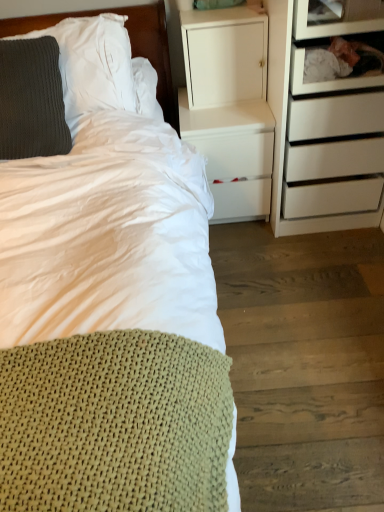
Question: From a real-world perspective, is transparent glass shelf at upper right, which ranks as the 1th shelf in top-to-bottom order, beneath knitted gray pillow at left, which ranks as the 2th pillow in bottom-to-top order?

Choices:
 (A) no
 (B) yes

Answer: (A)

Question: Is transparent glass shelf at upper right, the second shelf ordered from the bottom, located outside knitted gray pillow at left, which ranks as the 2th pillow in bottom-to-top order?

Choices:
 (A) no
 (B) yes

Answer: (B)

Question: Are transparent glass shelf at upper right, which ranks as the 1th shelf in top-to-bottom order, and knitted gray pillow at left, which ranks as the 2th pillow in bottom-to-top order, located far from each other?

Choices:
 (A) yes
 (B) no

Answer: (B)

Question: Is transparent glass shelf at upper right, the second shelf ordered from the bottom, in contact with knitted gray pillow at left, which is the 1th pillow in top-to-bottom order?

Choices:
 (A) yes
 (B) no

Answer: (B)

Question: Is transparent glass shelf at upper right, which ranks as the 1th shelf in top-to-bottom order, behind knitted gray pillow at left, which is the 1th pillow in top-to-bottom order?

Choices:
 (A) no
 (B) yes

Answer: (B)

Question: Would you say white matte nightstand at center is to the left or to the right of knitted gray pillow at left, which is the 1th pillow in top-to-bottom order, in the picture?

Choices:
 (A) right
 (B) left

Answer: (A)

Question: In terms of width, does white matte nightstand at center look wider or thinner when compared to knitted gray pillow at left, which ranks as the 2th pillow in bottom-to-top order?

Choices:
 (A) wide
 (B) thin

Answer: (A)

Question: Is point (241, 207) closer or farther from the camera than point (124, 80)?

Choices:
 (A) farther
 (B) closer

Answer: (A)

Question: From the image's perspective, is white matte nightstand at center above or below knitted gray pillow at left, which ranks as the 2th pillow in bottom-to-top order?

Choices:
 (A) below
 (B) above

Answer: (A)

Question: Is knitted green blanket at lower left to the left or to the right of dark gray knitted pillow at upper left, positioned as the 1th pillow in bottom-to-top order, in the image?

Choices:
 (A) left
 (B) right

Answer: (B)

Question: From a real-world perspective, is knitted green blanket at lower left above or below dark gray knitted pillow at upper left, the 2th pillow from the top?

Choices:
 (A) above
 (B) below

Answer: (B)

Question: Looking at the image, does knitted green blanket at lower left seem bigger or smaller compared to dark gray knitted pillow at upper left, the 2th pillow from the top?

Choices:
 (A) big
 (B) small

Answer: (A)

Question: Do you think knitted green blanket at lower left is within dark gray knitted pillow at upper left, the 2th pillow from the top, or outside of it?

Choices:
 (A) inside
 (B) outside

Answer: (B)

Question: From the image's perspective, is dark gray knitted pillow at upper left, the 2th pillow from the top, positioned above or below knitted gray pillow at left, which ranks as the 2th pillow in bottom-to-top order?

Choices:
 (A) below
 (B) above

Answer: (A)

Question: Considering the positions of point (18, 126) and point (66, 59), is point (18, 126) closer or farther from the camera than point (66, 59)?

Choices:
 (A) farther
 (B) closer

Answer: (B)